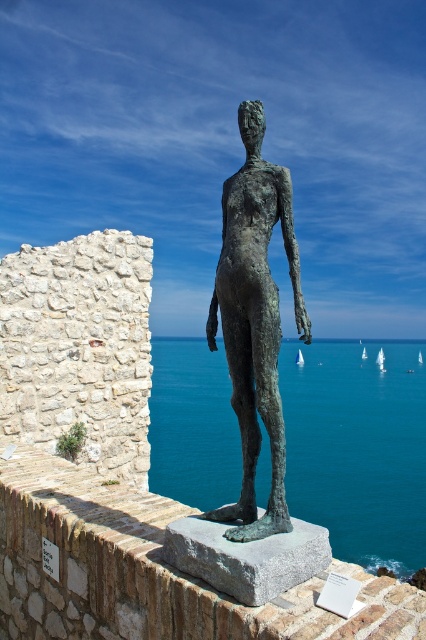
Is point (322, 468) closer to viewer compared to point (249, 483)?

No, (322, 468) is behind (249, 483).

The width and height of the screenshot is (426, 640). Describe the element at coordinates (357, 449) in the screenshot. I see `blue water at center` at that location.

Which is in front, point (417, 488) or point (259, 534)?

Point (259, 534) is more forward.

Find the location of `blue water at center`. blue water at center is located at coordinates (357, 449).

Is brick stone ledge at center closer to the viewer compared to bronze statue at center?

No, brick stone ledge at center is further to the viewer.

Does brick stone ledge at center appear under bronze statue at center?

Yes, brick stone ledge at center is below bronze statue at center.

Describe the element at coordinates (147, 572) in the screenshot. I see `brick stone ledge at center` at that location.

This screenshot has height=640, width=426. What are the coordinates of `brick stone ledge at center` in the screenshot? It's located at (147, 572).

Does point (406, 474) come in front of point (299, 636)?

No, it is not.

This screenshot has width=426, height=640. What do you see at coordinates (357, 449) in the screenshot? I see `blue water at center` at bounding box center [357, 449].

Who is more distant from viewer, (224, 410) or (49, 506)?

The point (224, 410) is more distant.

You are a GUI agent. You are given a task and a screenshot of the screen. Output one action in this format:
    pyautogui.click(x=<x>, y=<y>)
    Task: Click on the blue water at center
    The image size is (426, 640).
    Given the screenshot: What is the action you would take?
    pyautogui.click(x=357, y=449)